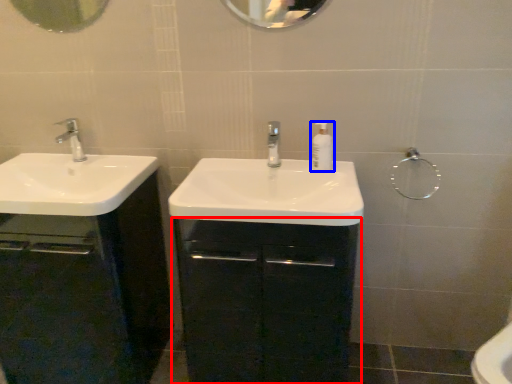
Question: Which of the following is the farthest to the observer, bathroom cabinet (highlighted by a red box) or soap dispenser (highlighted by a blue box)?

Choices:
 (A) bathroom cabinet
 (B) soap dispenser

Answer: (B)